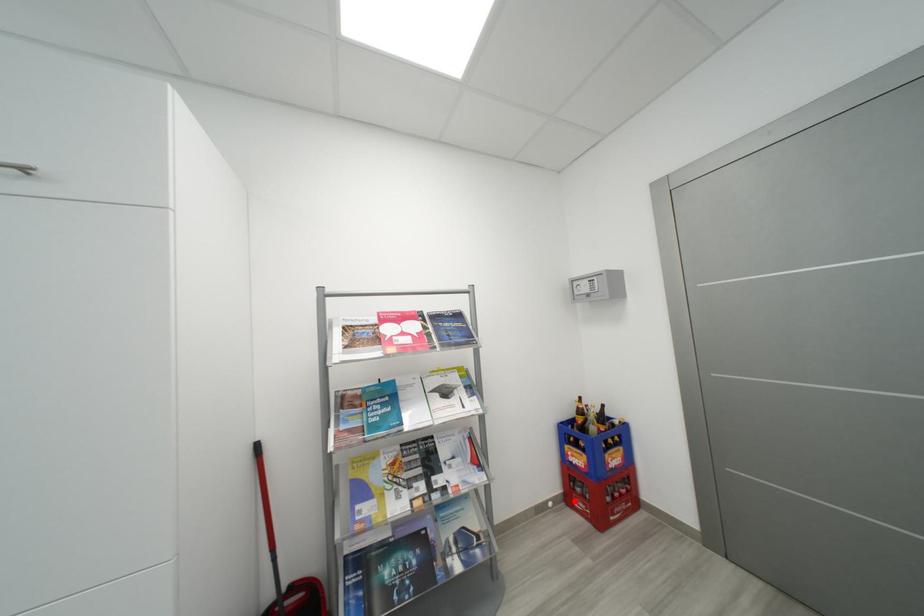
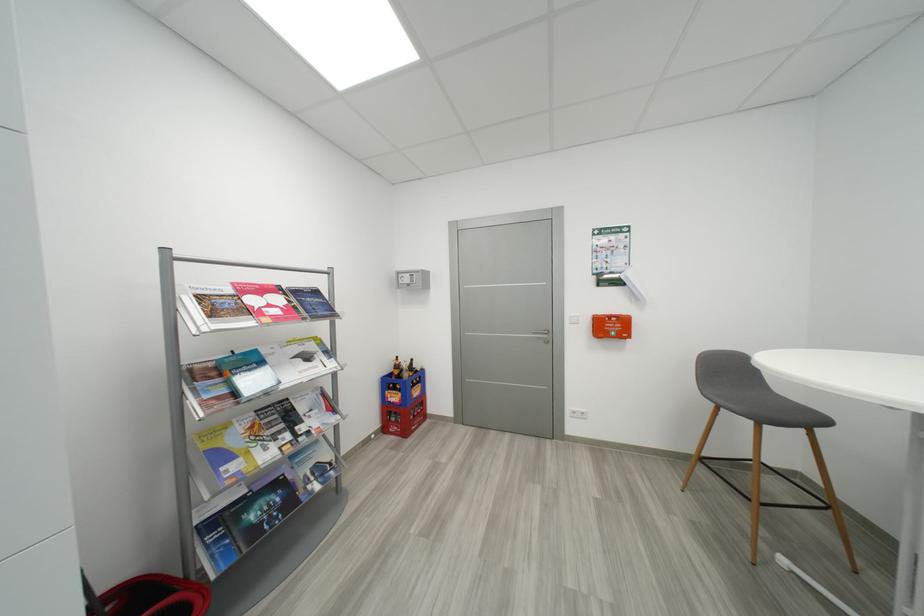
Find the pixel in the second image that matches the highlighted location in the first image.

(392, 431)